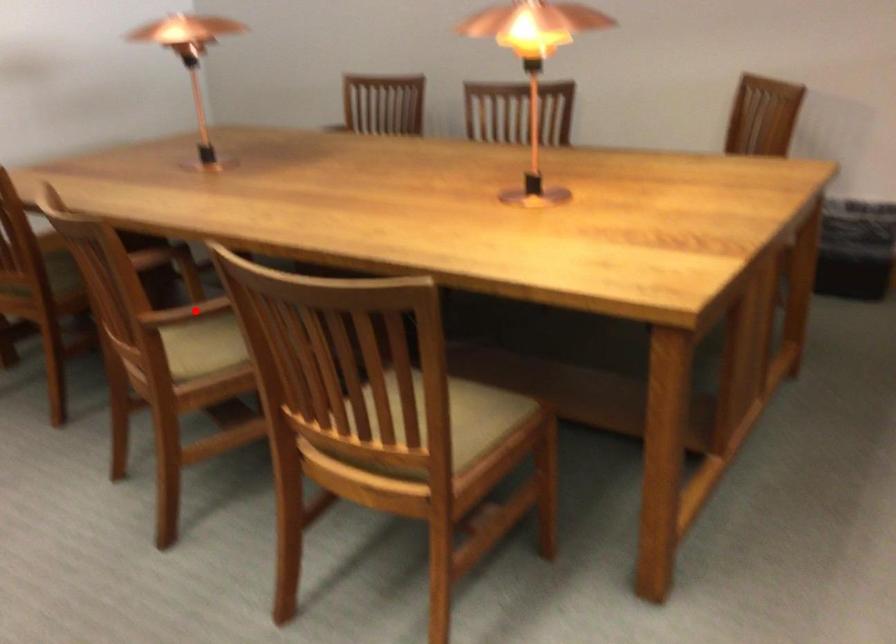
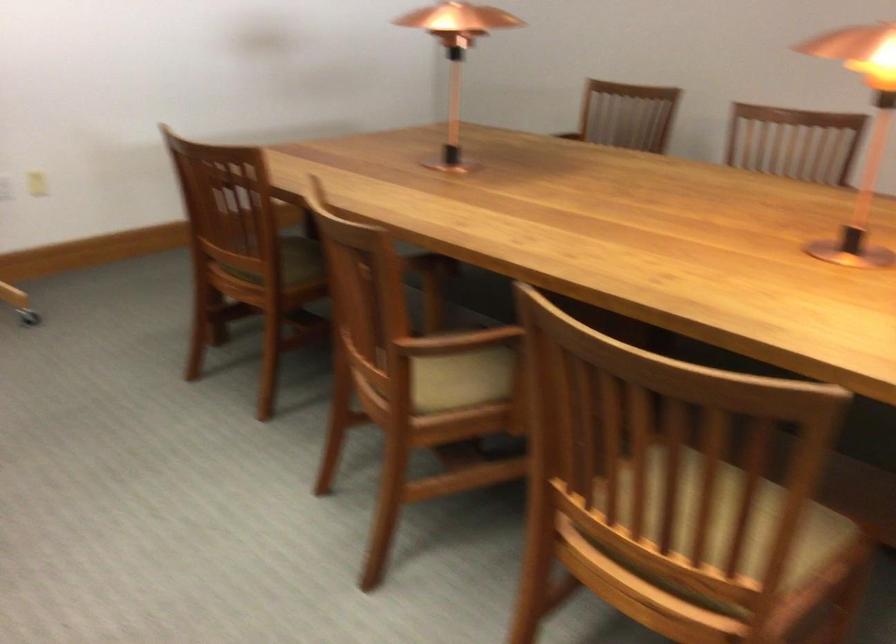
Locate, in the second image, the point that corresponds to the highlighted location in the first image.

(455, 342)